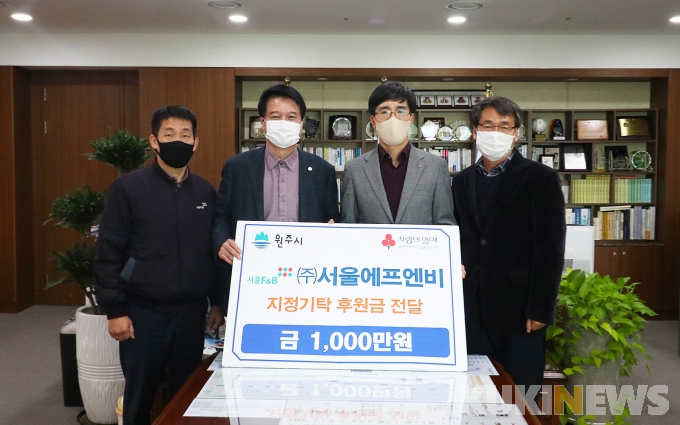
The width and height of the screenshot is (680, 425). I want to click on door, so click(58, 163).